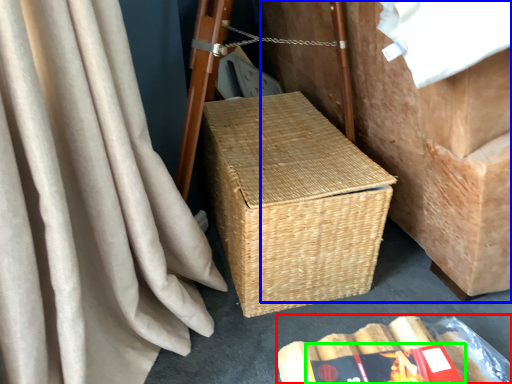
Question: Which object is the farthest from storage box (highlighted by a red box)? Choose among these: furniture (highlighted by a blue box) or paperback book (highlighted by a green box).

Choices:
 (A) furniture
 (B) paperback book

Answer: (A)